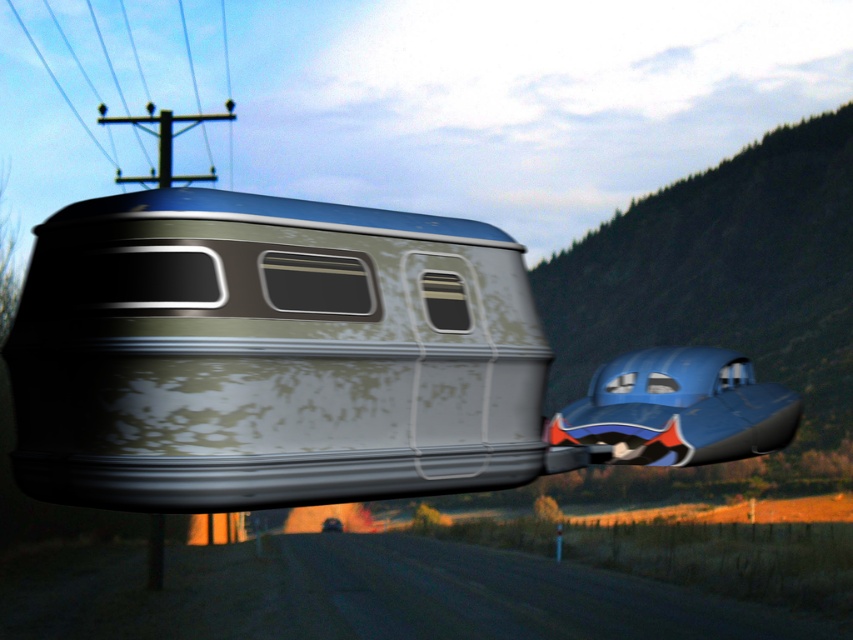
Question: Is rusty metal train car at center smaller than metallic wire at upper left?

Choices:
 (A) yes
 (B) no

Answer: (A)

Question: Which object is closer to the camera taking this photo?

Choices:
 (A) rusty metal train car at center
 (B) metallic wire at upper left
 (C) blue rubber car at center right

Answer: (A)

Question: Is rusty metal train car at center to the right of blue rubber car at center right from the viewer's perspective?

Choices:
 (A) no
 (B) yes

Answer: (A)

Question: Which object is positioned farthest from the metallic wire at upper left?

Choices:
 (A) blue rubber car at center right
 (B) rusty metal train car at center

Answer: (B)

Question: Can you confirm if rusty metal train car at center is wider than blue rubber car at center right?

Choices:
 (A) yes
 (B) no

Answer: (A)

Question: Estimate the real-world distances between objects in this image. Which object is closer to the metallic wire at upper left?

Choices:
 (A) blue rubber car at center right
 (B) rusty metal train car at center

Answer: (A)